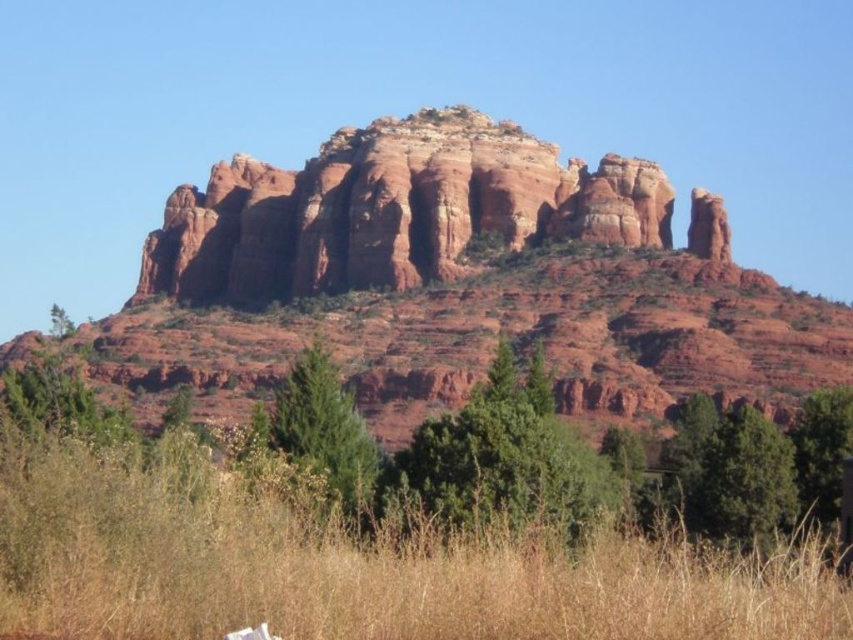
You are standing at the origin point in the image. Where is the dry grass at lower center located?

The dry grass at lower center is located at point 0.886 on the x axis and 0.411 on the y axis.